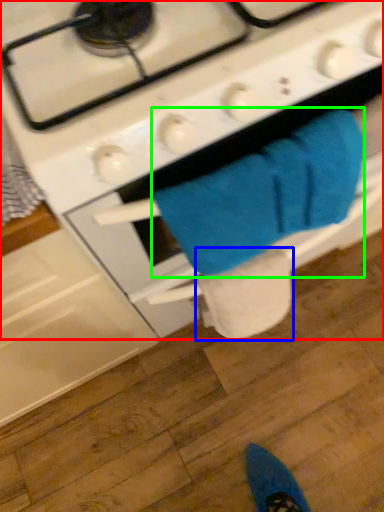
Question: Estimate the real-world distances between objects in this image. Which object is closer to gas stove (highlighted by a red box), toilet paper (highlighted by a blue box) or bath towel (highlighted by a green box)?

Choices:
 (A) toilet paper
 (B) bath towel

Answer: (B)